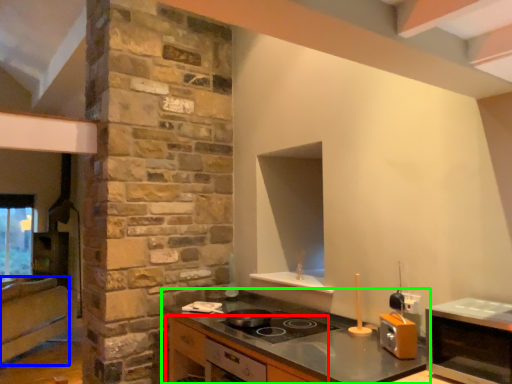
Question: Considering the real-world distances, which object is farthest from cabinetry (highlighted by a red box)? cabinetry (highlighted by a blue box) or countertop (highlighted by a green box)?

Choices:
 (A) cabinetry
 (B) countertop

Answer: (A)